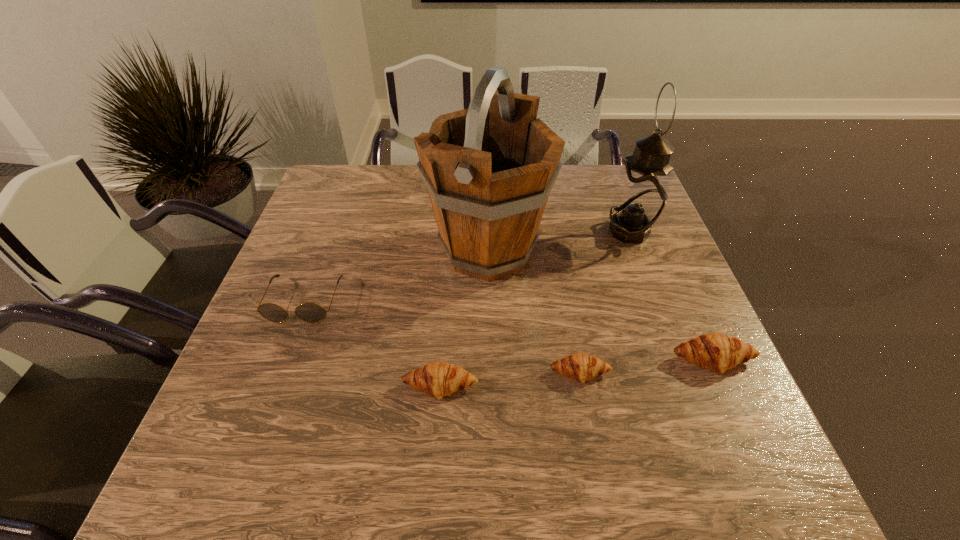
Find the location of a particular element. The width and height of the screenshot is (960, 540). vacant space at the far right corner of the desktop is located at coordinates (601, 191).

This screenshot has width=960, height=540. I want to click on free space at the near right corner of the desktop, so [x=712, y=415].

Locate an element on the screen. vacant space in between the leftmost object and the second tallest pastry is located at coordinates (372, 344).

Identify the location of free space between the rightmost pastry and the second pastry from left to right. This screenshot has height=540, width=960. (646, 367).

Where is `free space between the bucket and the shortest object`? The width and height of the screenshot is (960, 540). free space between the bucket and the shortest object is located at coordinates (534, 312).

Find the location of a particular element. This screenshot has width=960, height=540. vacant space that is in between the rightmost pastry and the oil lamp is located at coordinates (671, 296).

I want to click on empty location between the rightmost pastry and the oil lamp, so click(671, 296).

Identify the location of vacant area between the shortest object and the oil lamp. coord(605,302).

The width and height of the screenshot is (960, 540). Find the location of `vacant space in between the shortest object and the bucket`. vacant space in between the shortest object and the bucket is located at coordinates (534, 312).

Image resolution: width=960 pixels, height=540 pixels. Find the location of `vacant space that's between the sunglasses and the rightmost pastry`. vacant space that's between the sunglasses and the rightmost pastry is located at coordinates (508, 331).